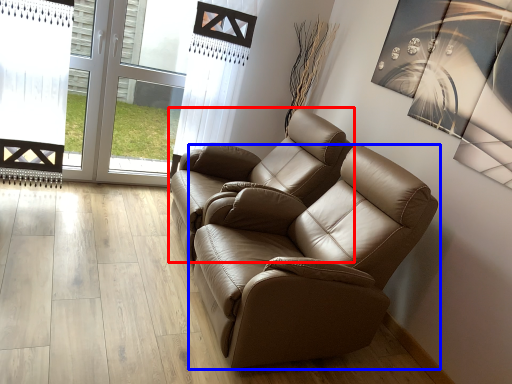
Question: Which object appears closest to the camera in this image, chair (highlighted by a red box) or chair (highlighted by a blue box)?

Choices:
 (A) chair
 (B) chair

Answer: (B)